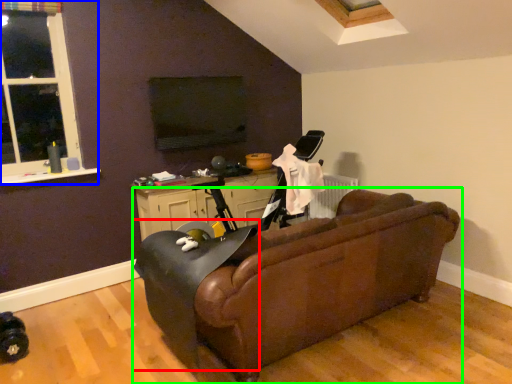
Question: Based on their relative distances, which object is nearer to swivel chair (highlighted by a red box)? Choose from window (highlighted by a blue box) and studio couch (highlighted by a green box).

Choices:
 (A) window
 (B) studio couch

Answer: (B)